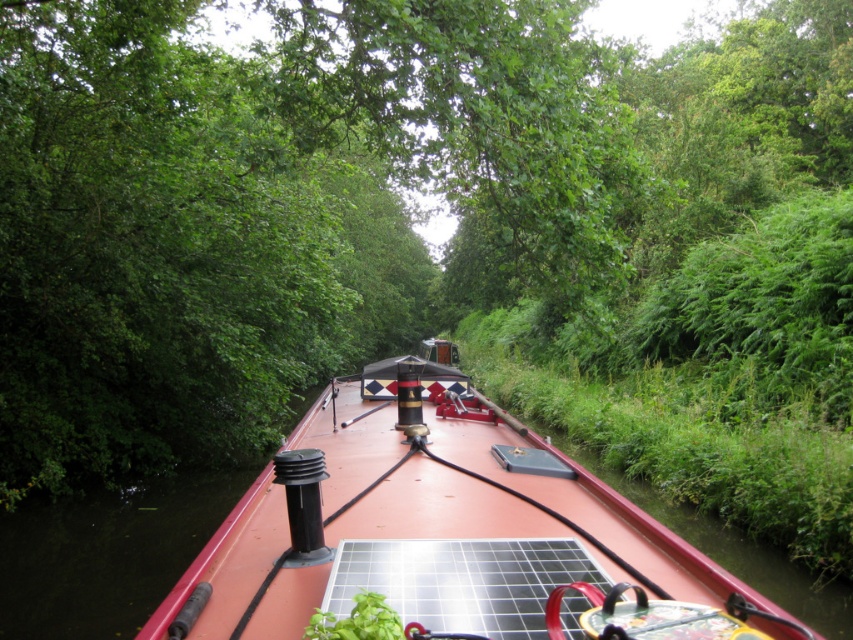
Question: Can you confirm if red matte boat at center is positioned to the right of black solar panel at center?

Choices:
 (A) no
 (B) yes

Answer: (A)

Question: Which object appears closest to the camera in this image?

Choices:
 (A) black solar panel at center
 (B) red matte boat at center

Answer: (A)

Question: Which object is farther from the camera taking this photo?

Choices:
 (A) black solar panel at center
 (B) red matte boat at center

Answer: (B)

Question: Does red matte boat at center lie behind black solar panel at center?

Choices:
 (A) yes
 (B) no

Answer: (A)

Question: Is red matte boat at center in front of black solar panel at center?

Choices:
 (A) no
 (B) yes

Answer: (A)